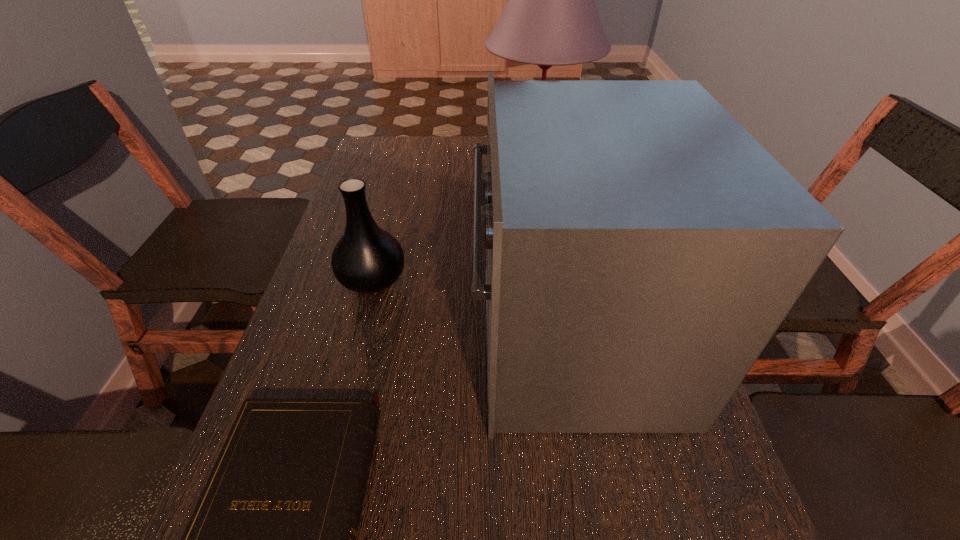
The image size is (960, 540). I want to click on free point located 0.210m on the back of the vase, so click(391, 207).

Identify the location of object at the far edge. (550, 19).

Image resolution: width=960 pixels, height=540 pixels. I want to click on object at the left edge, so click(x=367, y=259).

Image resolution: width=960 pixels, height=540 pixels. Identify the location of table lamp located in the right edge section of the desktop. (550, 19).

You are a GUI agent. You are given a task and a screenshot of the screen. Output one action in this format:
    pyautogui.click(x=<x>, y=<y>)
    Task: Click on the toaster oven present at the right edge
    This screenshot has height=540, width=960.
    Given the screenshot: What is the action you would take?
    pyautogui.click(x=642, y=248)

In order to click on object that is at the far right corner in this screenshot , I will do `click(550, 19)`.

This screenshot has height=540, width=960. In the image, there is a desktop. What are the coordinates of `vacant space at the left edge` in the screenshot? It's located at (350, 371).

This screenshot has height=540, width=960. I want to click on blank area at the right edge, so click(x=727, y=515).

Locate an element on the screen. Image resolution: width=960 pixels, height=540 pixels. vacant space at the far left corner of the desktop is located at coordinates (370, 141).

You are a GUI agent. You are given a task and a screenshot of the screen. Output one action in this format:
    pyautogui.click(x=<x>, y=<y>)
    Task: Click on the unoccupied area between the table lamp and the second shortest object
    This screenshot has width=960, height=540.
    Given the screenshot: What is the action you would take?
    pyautogui.click(x=454, y=222)